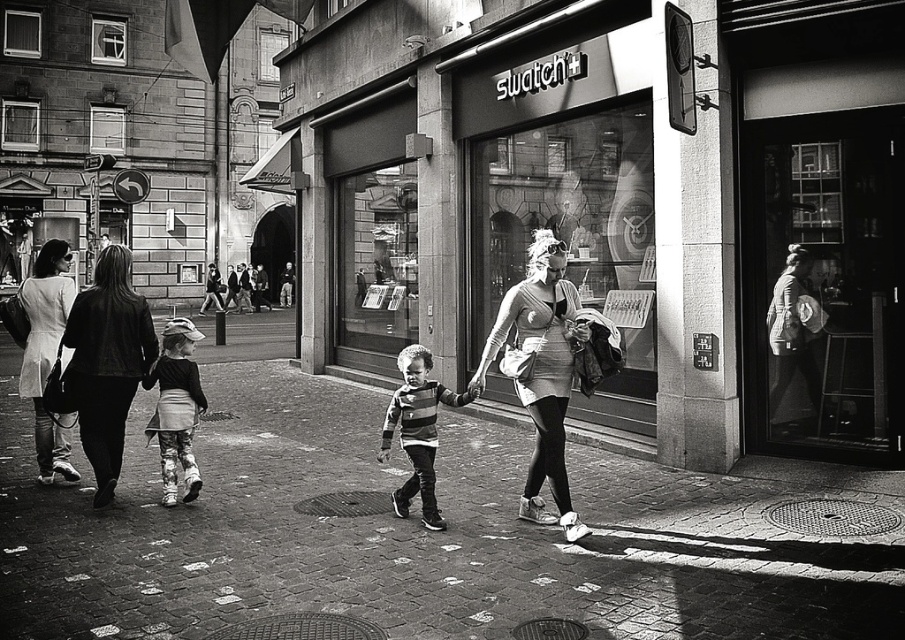
Is brick pavement at center above floral-patterned pants at left?

Incorrect, brick pavement at center is not positioned above floral-patterned pants at left.

Is point (376, 625) positioned behind point (186, 324)?

No, it is not.

This screenshot has width=905, height=640. In order to click on brick pavement at center in this screenshot , I will do `click(427, 536)`.

Between striped fabric shirt at center and floral-patterned pants at left, which one is positioned lower?

striped fabric shirt at center is lower down.

Image resolution: width=905 pixels, height=640 pixels. I want to click on striped fabric shirt at center, so click(x=417, y=429).

Is matte white dress at center in front of black leather jacket at left?

Yes, it is in front of black leather jacket at left.

How far apart are matte white dress at center and black leather jacket at left?

The distance of matte white dress at center from black leather jacket at left is 2.79 meters.

The image size is (905, 640). Find the location of `matte white dress at center`. matte white dress at center is located at coordinates (541, 371).